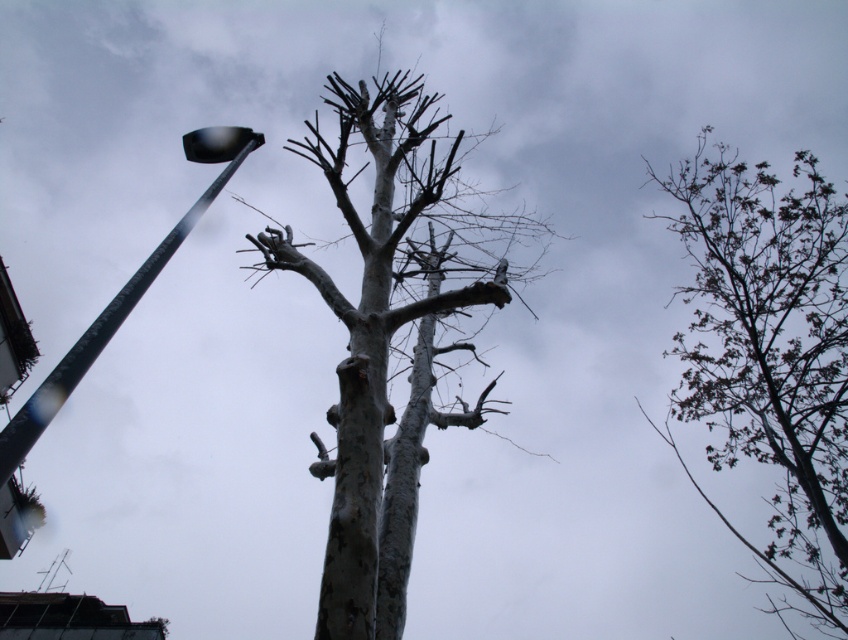
Question: Observing the image, what is the correct spatial positioning of smooth bark tree at center in reference to metallic gray street light at left?

Choices:
 (A) right
 (B) left

Answer: (A)

Question: Does smooth bark tree at center appear under dark green leafy tree at upper right?

Choices:
 (A) no
 (B) yes

Answer: (A)

Question: Which object is positioned closest to the metallic gray street light at left?

Choices:
 (A) dark green leafy tree at upper right
 (B) smooth bark tree at center

Answer: (B)

Question: Which of these objects is positioned farthest from the smooth bark tree at center?

Choices:
 (A) dark green leafy tree at upper right
 (B) metallic gray street light at left

Answer: (B)

Question: Among these objects, which one is farthest from the camera?

Choices:
 (A) metallic gray street light at left
 (B) smooth bark tree at center
 (C) dark green leafy tree at upper right

Answer: (C)

Question: Is dark green leafy tree at upper right wider than metallic gray street light at left?

Choices:
 (A) no
 (B) yes

Answer: (B)